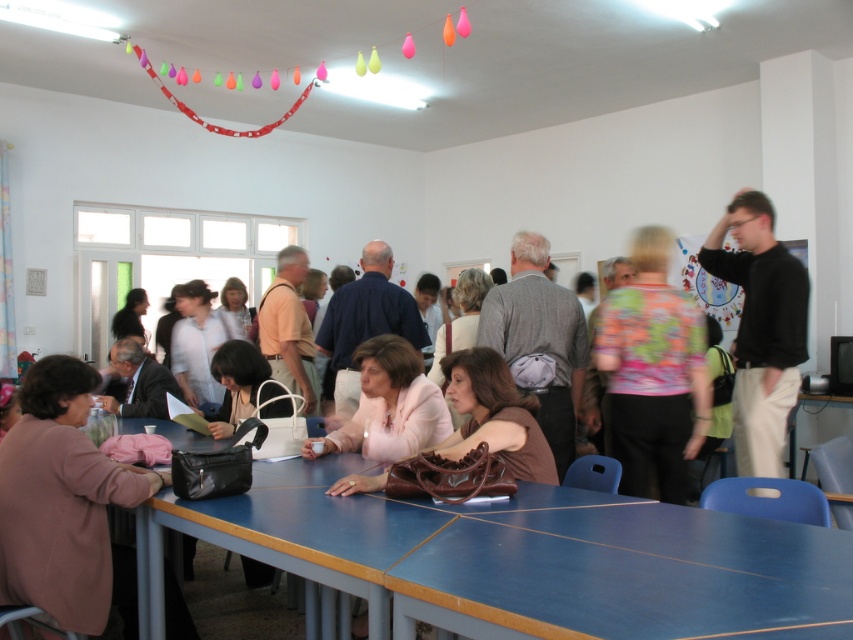
You are organizing a photo shoot and need to place a prop that requires more space. The scene has a pink fabric purse at lower left and a black cotton shirt at right. Which object should you choose for the prop if you need an item that takes up more horizontal space?

The pink fabric purse at lower left should be chosen because its width surpasses that of the black cotton shirt at right, making it the better option for requiring more space.

You are standing at the entrance of the room and want to locate the pink fabric purse at lower left. According to the coordinates provided, where should you look relative to the bottom edge of the image?

The pink fabric purse at lower left is located at point 0.781 along the horizontal axis and 0.073 along the vertical axis from the bottom edge of the image. Since the vertical coordinate is very low, it is near the bottom edge. The horizontal coordinate 0.781 places it closer to the right side of the image. Therefore, you should look near the bottom right corner of the image to find the pink fabric purse at lower left.